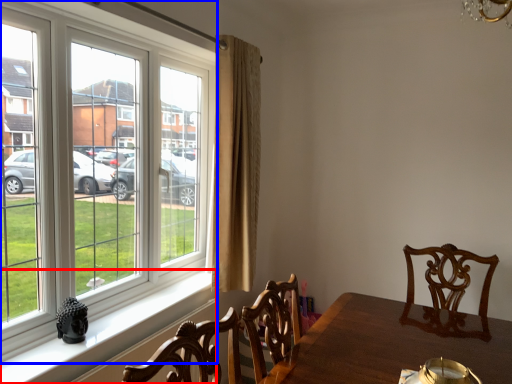
Question: Among these objects, which one is farthest to the camera, window sill (highlighted by a red box) or window (highlighted by a blue box)?

Choices:
 (A) window sill
 (B) window

Answer: (A)